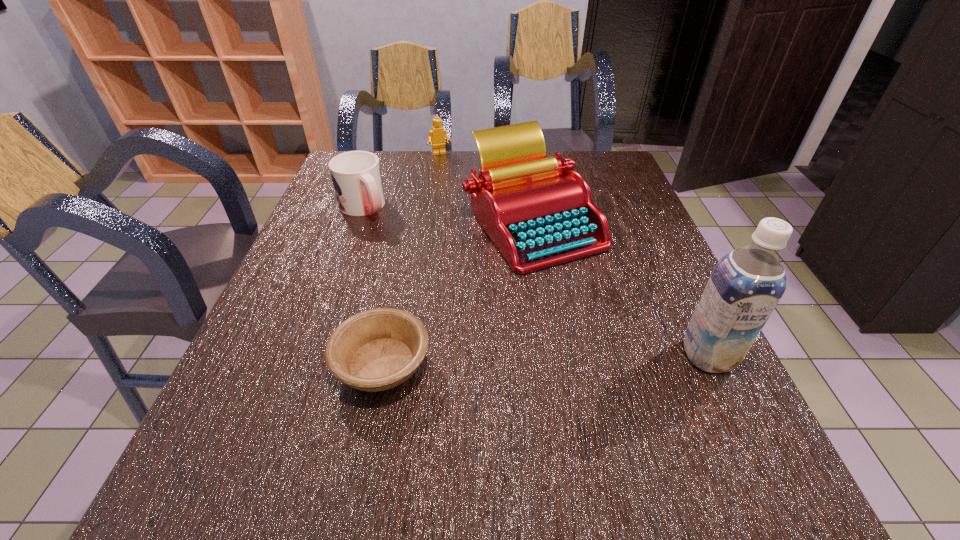
Locate an element on the screen. The height and width of the screenshot is (540, 960). free space between the bowl and the typewriter is located at coordinates (457, 293).

Identify which object is the nearest to the mug. Please provide its 2D coordinates. Your answer should be formatted as a tuple, i.e. [(x, y)], where the tuple contains the x and y coordinates of a point satisfying the conditions above.

[(538, 212)]

Identify which object is located as the nearest to the farthest object. Please provide its 2D coordinates. Your answer should be formatted as a tuple, i.e. [(x, y)], where the tuple contains the x and y coordinates of a point satisfying the conditions above.

[(538, 212)]

Identify the location of free location that satisfies the following two spatial constraints: 1. on the back side of the second object from right to left; 2. on the left side of the bowl. The image size is (960, 540). (411, 223).